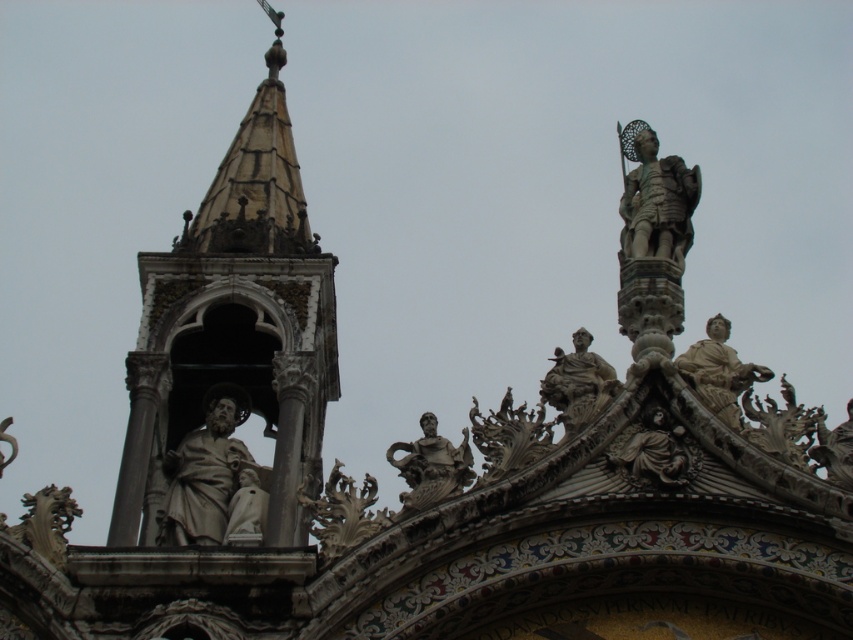
Question: From the image, what is the correct spatial relationship of bronze statue at upper right in relation to gray stone angel at center?

Choices:
 (A) above
 (B) below

Answer: (A)

Question: Can you confirm if stone statue at left is positioned to the right of carved stone ornament at center?

Choices:
 (A) no
 (B) yes

Answer: (A)

Question: In this image, where is stone statue at left located relative to polished stone statue at center?

Choices:
 (A) left
 (B) right

Answer: (A)

Question: Estimate the real-world distances between objects in this image. Which object is farther from the bronze statue at upper right?

Choices:
 (A) white marble statue at upper right
 (B) gray stone angel at center
 (C) beige stone statue at center-left
 (D) polished stone statue at center

Answer: (D)

Question: Which point appears closest to the camera in this image?

Choices:
 (A) (358, 504)
 (B) (213, 524)
 (C) (734, 419)
 (D) (581, 417)

Answer: (A)

Question: Estimate the real-world distances between objects in this image. Which object is closer to the polished bronze statue at center-right?

Choices:
 (A) polished stone statue at center
 (B) stone statue at left
 (C) beige stone statue at center-left

Answer: (A)